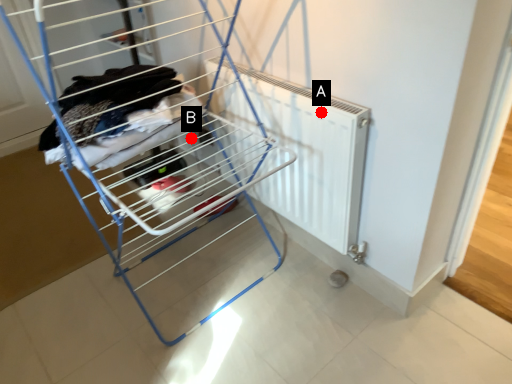
Question: Two points are circled on the image, labeled by A and B beside each circle. Which point appears farthest from the camera in this image?

Choices:
 (A) A is further
 (B) B is further

Answer: (B)